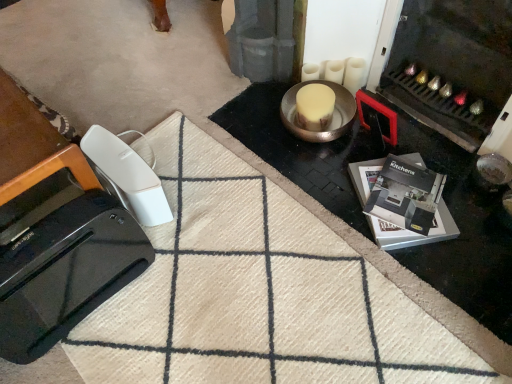
At what (x,y) coordinates should I click in order to perform the action: click on vacant area on top of black glossy kitchens brochure at lower right (from a real-world perspective). Please return your answer as a coordinate pair (x, y). This screenshot has height=384, width=512. Looking at the image, I should click on (397, 194).